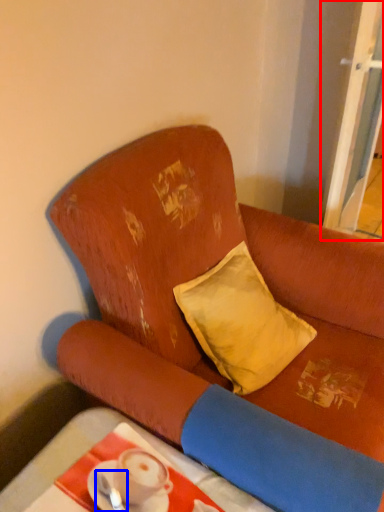
Question: Which object appears farthest to the camera in this image, screen door (highlighted by a red box) or tableware (highlighted by a blue box)?

Choices:
 (A) screen door
 (B) tableware

Answer: (A)